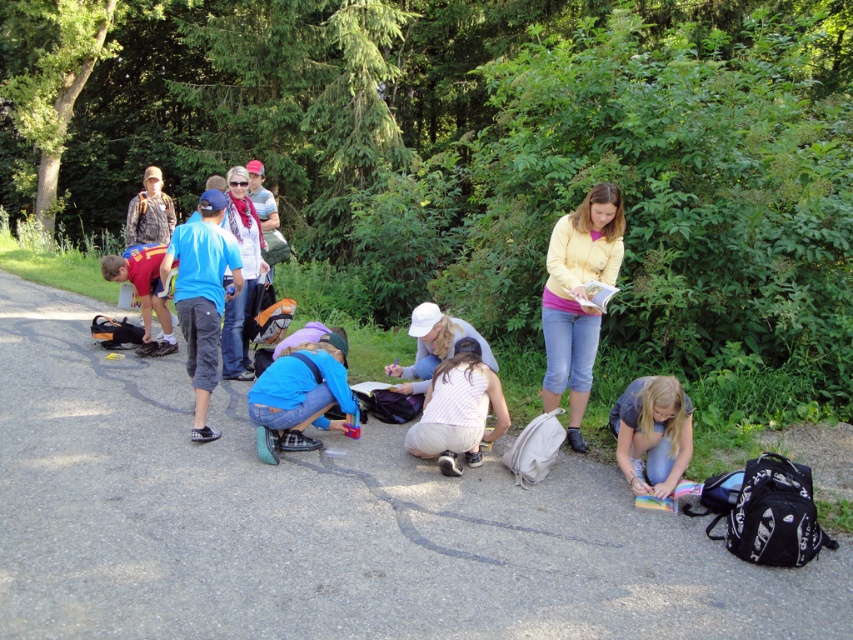
You are a photographer standing at the center of the paved path. You want to take a photo that includes both the blue denim jeans at center and the matte red shirt at lower left. Based on their positions, will the two subjects be in the same frame?

The blue denim jeans at center is 9.78 feet away from the matte red shirt at lower left. Since the distance between them is moderate, they can likely be captured in the same frame if the camera has an appropriate zoom level or wide enough angle.

You are a photographer trying to capture a photo of the denim jeans at lower right and the matte red shirt at lower left. From your current position, which object is located to the right of the other?

The denim jeans at lower right is positioned on the right side of matte red shirt at lower left.